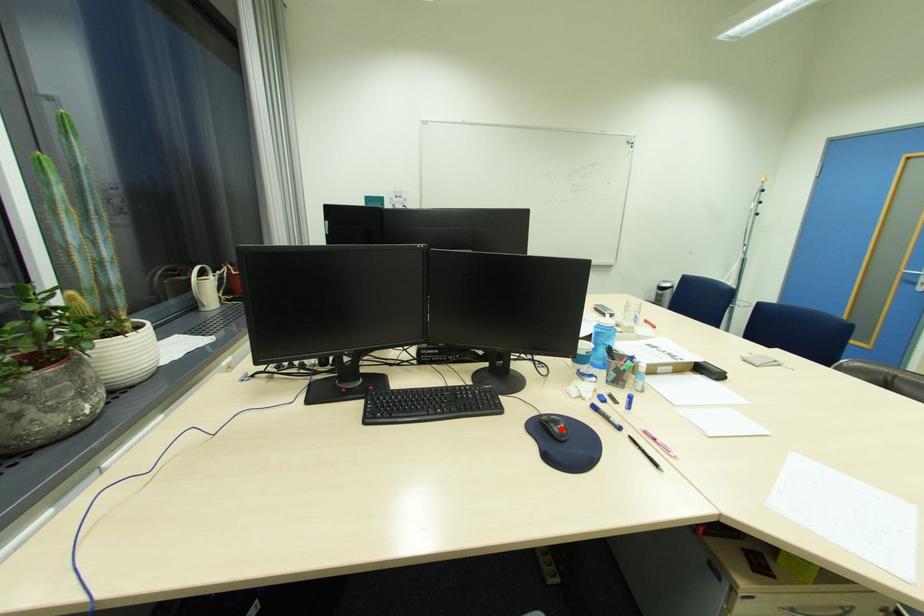
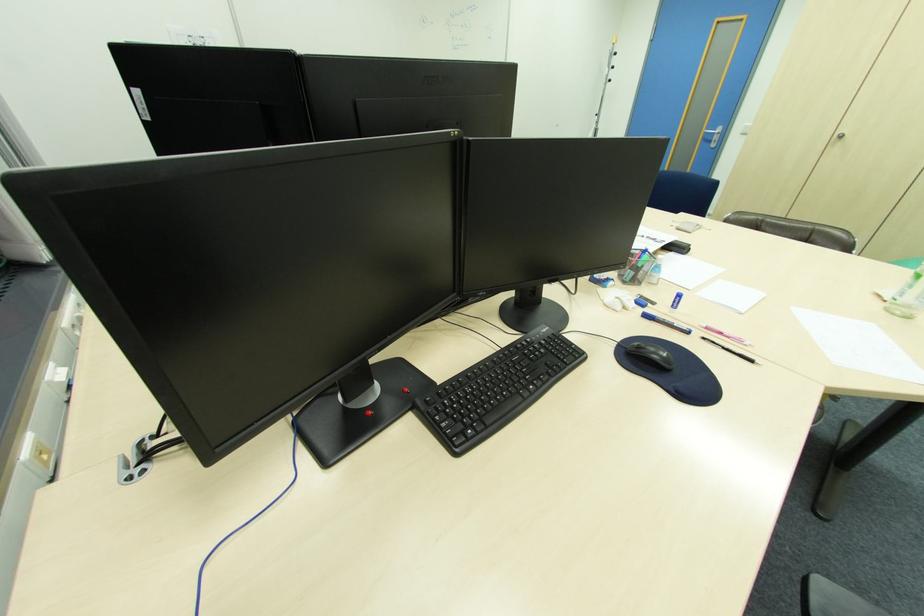
In the second image, find the point that corresponds to the highlighted location in the first image.

(662, 358)